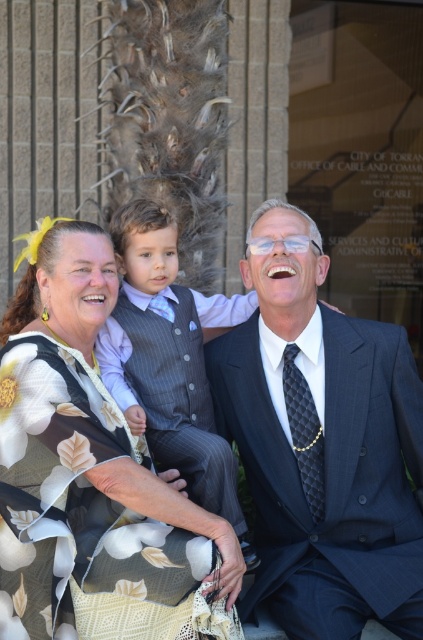
Is the position of gray pinstripe vest at center more distant than that of dark blue textured suit at center?

No, gray pinstripe vest at center is in front of dark blue textured suit at center.

Who is shorter, gray pinstripe vest at center or dark blue textured suit at center?

With less height is dark blue textured suit at center.

Is point (142, 396) in front of point (186, 464)?

No, (142, 396) is behind (186, 464).

I want to click on gray pinstripe vest at center, so click(x=169, y=356).

Who is more forward, (91, 378) or (121, 410)?

Point (91, 378) is in front.

Is point (65, 637) positioned before point (129, 380)?

Yes, it is in front of point (129, 380).

Does point (82, 420) lie behind point (145, 240)?

No, (82, 420) is in front of (145, 240).

Where is `floral fabric dress at center`? Image resolution: width=423 pixels, height=640 pixels. floral fabric dress at center is located at coordinates (91, 476).

Is dark blue pinstripe suit at center thinner than gray pinstripe vest at center?

No, dark blue pinstripe suit at center is not thinner than gray pinstripe vest at center.

Does dark blue pinstripe suit at center have a greater width compared to gray pinstripe vest at center?

Yes.

Does point (308, 278) come farther from viewer compared to point (164, 444)?

Yes, it is.

Where is `dark blue pinstripe suit at center`? dark blue pinstripe suit at center is located at coordinates (321, 444).